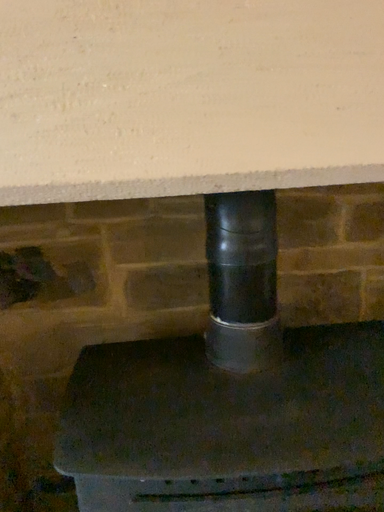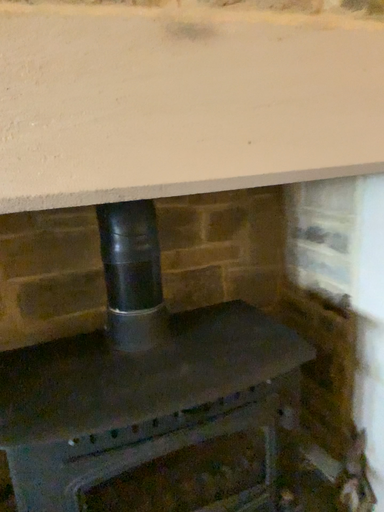
Question: Which way did the camera rotate in the video?

Choices:
 (A) rotated left
 (B) rotated right

Answer: (B)